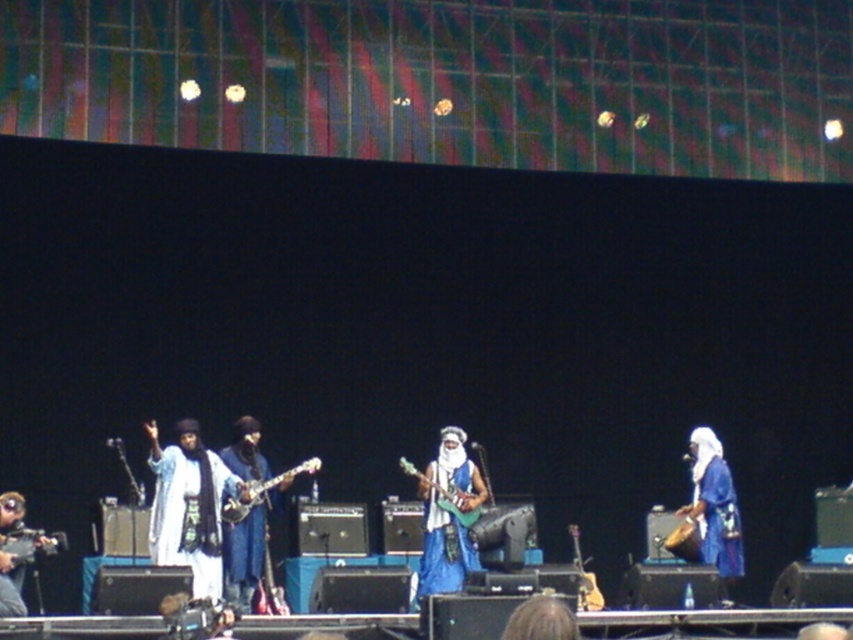
Question: Can you confirm if wooden drum at center is positioned below shiny metallic guitar at center?

Choices:
 (A) no
 (B) yes

Answer: (B)

Question: Which object is closer to the camera taking this photo?

Choices:
 (A) green matte electric guitar at center
 (B) blue fabric guitar at center
 (C) white matte clothing at center
 (D) blue denim jeans at center

Answer: (D)

Question: Which of the following is the farthest from the observer?

Choices:
 (A) wooden drum at center
 (B) blue fabric guitar at center
 (C) green matte electric guitar at center

Answer: (C)

Question: Does blue fabric guitar at center have a lesser width compared to blue fabric at center?

Choices:
 (A) yes
 (B) no

Answer: (A)

Question: Which of the following is the farthest from the observer?

Choices:
 (A) shiny metallic guitar at center
 (B) dark blue fabric headscarf at center

Answer: (A)

Question: Can you confirm if blue fabric at center is positioned below shiny metallic guitar at center?

Choices:
 (A) no
 (B) yes

Answer: (B)